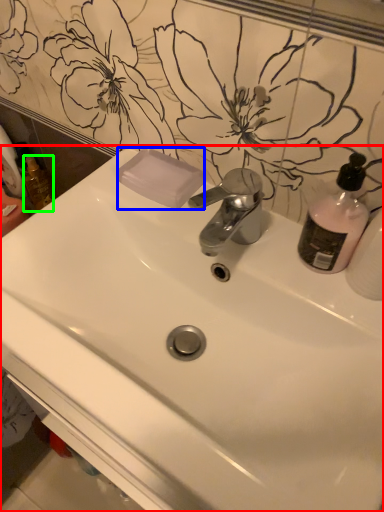
Question: Which is nearer to the sink (highlighted by a red box)? soap (highlighted by a blue box) or mouthwash (highlighted by a green box).

Choices:
 (A) soap
 (B) mouthwash

Answer: (A)